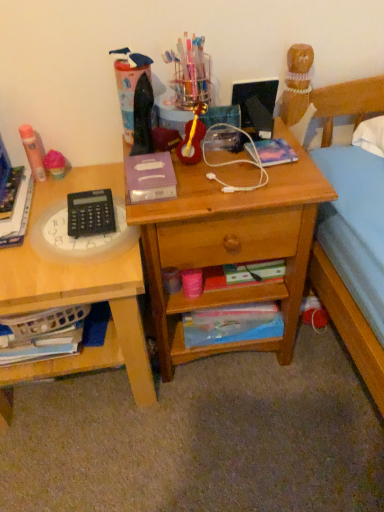
Question: Can you confirm if matte blue paperback book at lower center, marked as the first paperback book in a back-to-front arrangement, is positioned to the right of wooden desk at left?

Choices:
 (A) no
 (B) yes

Answer: (B)

Question: Considering the relative sizes of matte blue paperback book at lower center, the third paperback book positioned from the front, and wooden desk at left in the image provided, is matte blue paperback book at lower center, the third paperback book positioned from the front, bigger than wooden desk at left?

Choices:
 (A) yes
 (B) no

Answer: (B)

Question: Does matte blue paperback book at lower center, marked as the first paperback book in a bottom-to-top arrangement, have a greater width compared to wooden desk at left?

Choices:
 (A) no
 (B) yes

Answer: (A)

Question: Is matte blue paperback book at lower center, marked as the first paperback book in a bottom-to-top arrangement, positioned in front of wooden desk at left?

Choices:
 (A) no
 (B) yes

Answer: (A)

Question: Is matte blue paperback book at lower center, the third paperback book positioned from the front, shorter than wooden desk at left?

Choices:
 (A) yes
 (B) no

Answer: (A)

Question: Does matte blue paperback book at lower center, marked as the third paperback book in a top-to-bottom arrangement, come behind wooden desk at left?

Choices:
 (A) yes
 (B) no

Answer: (A)

Question: Can we say pink fluffy ball at left, which is the second stationery in right-to-left order, lies outside wooden desk at center?

Choices:
 (A) no
 (B) yes

Answer: (B)

Question: From the image's perspective, is pink fluffy ball at left, which is the second stationery in right-to-left order, beneath wooden desk at center?

Choices:
 (A) yes
 (B) no

Answer: (B)

Question: Is pink fluffy ball at left, which is the second stationery in right-to-left order, closer to the viewer compared to wooden desk at center?

Choices:
 (A) no
 (B) yes

Answer: (A)

Question: Does pink fluffy ball at left, which is the second stationery from left to right, have a larger size compared to wooden desk at center?

Choices:
 (A) no
 (B) yes

Answer: (A)

Question: Is pink fluffy ball at left, which is the second stationery from left to right, further to the viewer compared to wooden desk at center?

Choices:
 (A) yes
 (B) no

Answer: (A)

Question: Is pink fluffy ball at left, which is the second stationery in right-to-left order, facing away from wooden desk at center?

Choices:
 (A) no
 (B) yes

Answer: (A)

Question: Are purple matte paperback book at center, which appears as the 2th paperback book when viewed from the top, and matte orange glue stick at left, marked as the first stationery in a left-to-right arrangement, located far from each other?

Choices:
 (A) yes
 (B) no

Answer: (B)